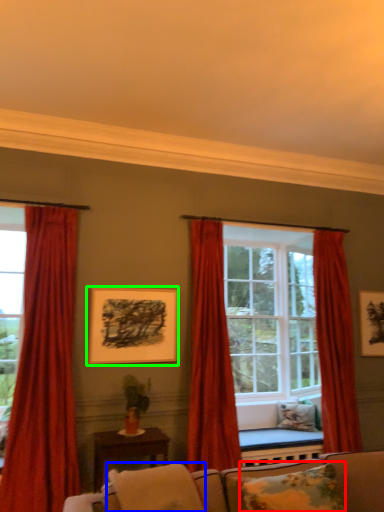
Question: Estimate the real-world distances between objects in this image. Which object is closer to pillow (highlighted by a red box), pillow (highlighted by a blue box) or picture frame (highlighted by a green box)?

Choices:
 (A) pillow
 (B) picture frame

Answer: (A)